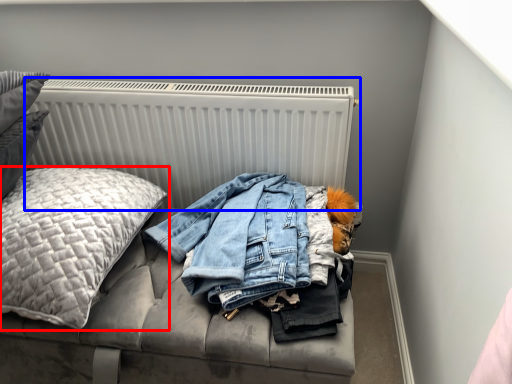
Question: Which object appears closest to the camera in this image, pillow (highlighted by a red box) or radiator (highlighted by a blue box)?

Choices:
 (A) pillow
 (B) radiator

Answer: (A)